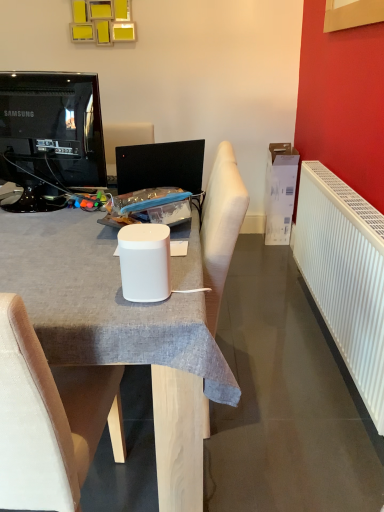
Where is `free space between white matte speaker at center and black glossy television at upper left`? The width and height of the screenshot is (384, 512). free space between white matte speaker at center and black glossy television at upper left is located at coordinates (63, 238).